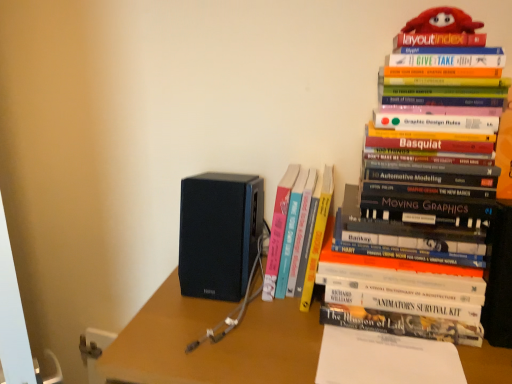
Find the location of a particular element. empty space that is ontop of white paper at center (from a real-world perspective) is located at coordinates (382, 351).